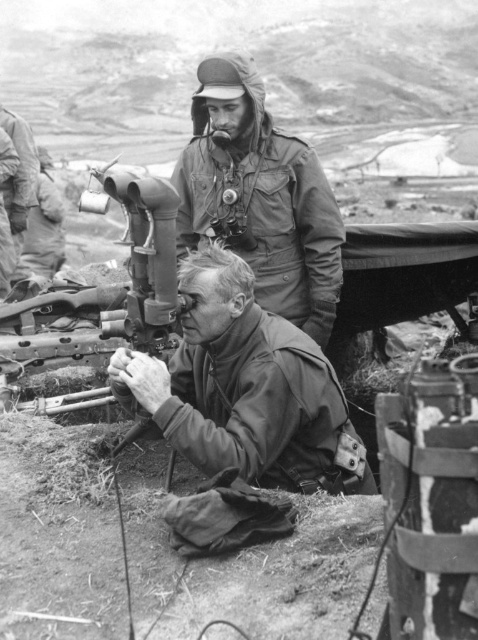
Between matte green uniform at upper center and matte black rifle at left, which one appears on the right side from the viewer's perspective?

From the viewer's perspective, matte green uniform at upper center appears more on the right side.

Does matte green uniform at upper center lie behind matte black rifle at left?

No.

Which is in front, point (258, 205) or point (10, 166)?

Point (258, 205) is in front.

Find the location of a particular element. matte green uniform at upper center is located at coordinates (260, 196).

Is the position of matte green uniform at center more distant than that of matte black rifle at left?

No.

Is matte green uniform at center positioned in front of matte black rifle at left?

Yes, it is in front of matte black rifle at left.

Which is behind, point (143, 396) or point (13, 147)?

Positioned behind is point (13, 147).

I want to click on matte green uniform at center, so click(x=246, y=388).

In the scene shown: Is matte green uniform at upper center shorter than camouflage fabric jacket at left?

Indeed, matte green uniform at upper center has a lesser height compared to camouflage fabric jacket at left.

Between matte green uniform at upper center and camouflage fabric jacket at left, which one appears on the left side from the viewer's perspective?

camouflage fabric jacket at left

Locate an element on the screen. matte green uniform at upper center is located at coordinates (260, 196).